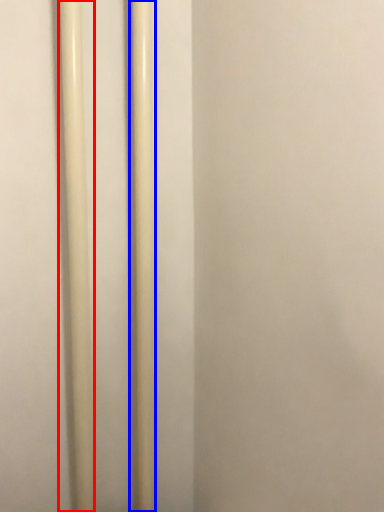
Question: Which object appears farthest to the camera in this image, pole (highlighted by a red box) or pole (highlighted by a blue box)?

Choices:
 (A) pole
 (B) pole

Answer: (B)